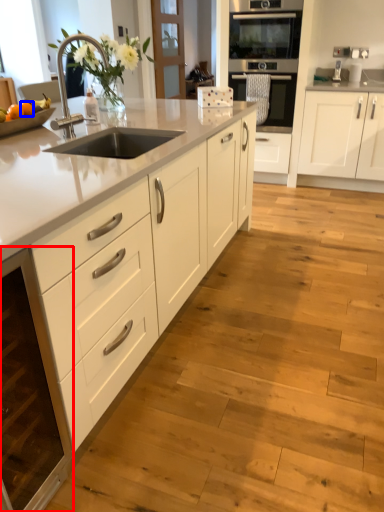
Question: Among these objects, which one is nearest to the camera, cabinetry (highlighted by a red box) or orange (highlighted by a blue box)?

Choices:
 (A) cabinetry
 (B) orange

Answer: (A)